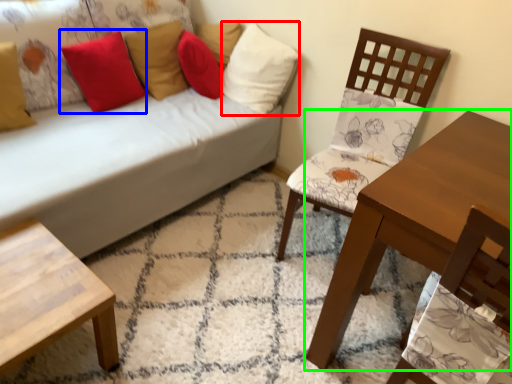
Question: Considering the real-world distances, which object is closest to pillow (highlighted by a red box)? pillow (highlighted by a blue box) or table (highlighted by a green box).

Choices:
 (A) pillow
 (B) table

Answer: (A)